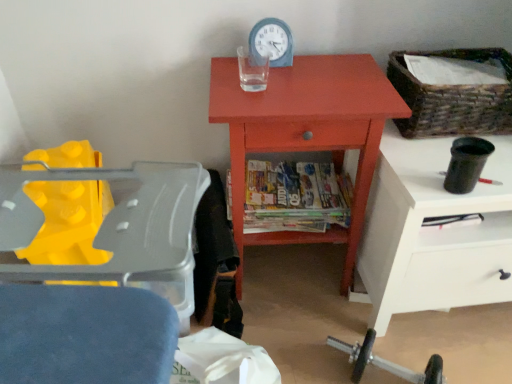
Question: Should I look upward or downward to see matte orange cabinet at center?

Choices:
 (A) up
 (B) down

Answer: (A)

Question: Is white glossy nightstand at right at the left side of blue plastic clock at upper center?

Choices:
 (A) yes
 (B) no

Answer: (B)

Question: Does white glossy nightstand at right have a lesser height compared to blue plastic clock at upper center?

Choices:
 (A) yes
 (B) no

Answer: (B)

Question: Is white glossy nightstand at right positioned with its back to blue plastic clock at upper center?

Choices:
 (A) yes
 (B) no

Answer: (B)

Question: Is blue plastic clock at upper center a part of white glossy nightstand at right?

Choices:
 (A) yes
 (B) no

Answer: (B)

Question: From a real-world perspective, is white glossy nightstand at right positioned over blue plastic clock at upper center based on gravity?

Choices:
 (A) no
 (B) yes

Answer: (A)

Question: Is white glossy nightstand at right taller than blue plastic clock at upper center?

Choices:
 (A) no
 (B) yes

Answer: (B)

Question: Considering the relative sizes of matte orange cabinet at center and woven brown basket at upper right in the image provided, is matte orange cabinet at center thinner than woven brown basket at upper right?

Choices:
 (A) yes
 (B) no

Answer: (B)

Question: From the image's perspective, is matte orange cabinet at center on woven brown basket at upper right?

Choices:
 (A) yes
 (B) no

Answer: (B)

Question: Is matte orange cabinet at center in front of woven brown basket at upper right?

Choices:
 (A) yes
 (B) no

Answer: (A)

Question: Would you consider matte orange cabinet at center to be distant from woven brown basket at upper right?

Choices:
 (A) no
 (B) yes

Answer: (A)

Question: Does matte orange cabinet at center lie behind woven brown basket at upper right?

Choices:
 (A) yes
 (B) no

Answer: (B)

Question: Is matte orange cabinet at center turned away from woven brown basket at upper right?

Choices:
 (A) no
 (B) yes

Answer: (A)

Question: Considering the relative sizes of multicolored glossy magazines at center and blue plastic clock at upper center in the image provided, is multicolored glossy magazines at center taller than blue plastic clock at upper center?

Choices:
 (A) no
 (B) yes

Answer: (A)